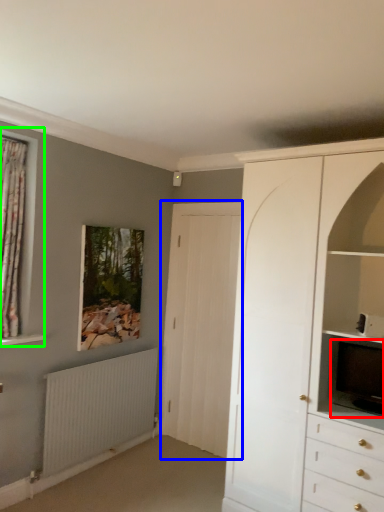
Question: Which object is positioned farthest from television (highlighted by a red box)? Select from door (highlighted by a blue box) and window (highlighted by a green box).

Choices:
 (A) door
 (B) window

Answer: (B)